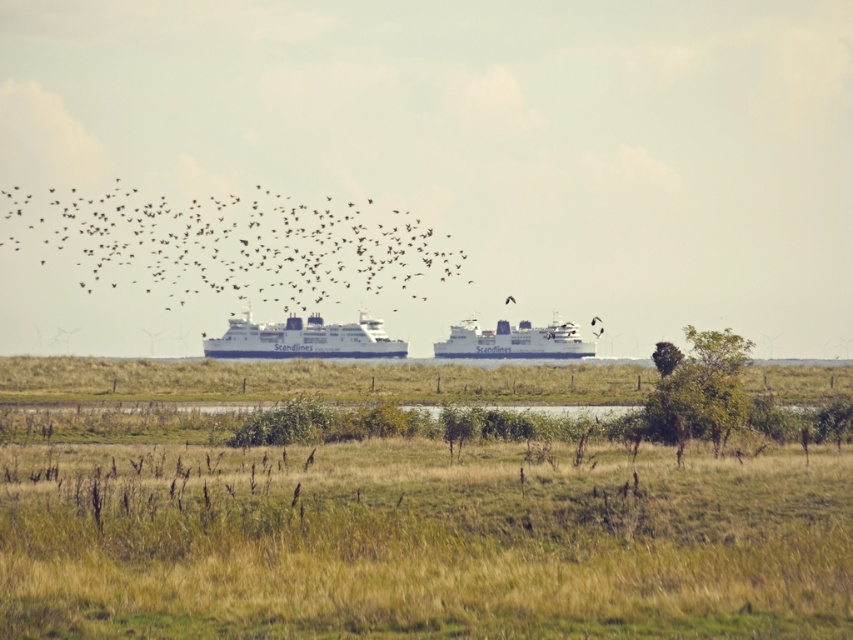
Question: Is the position of black matte birds at upper center more distant than that of black matte bird at center?

Choices:
 (A) no
 (B) yes

Answer: (B)

Question: Can you confirm if black matte birds at upper center is smaller than white matte ferry at center?

Choices:
 (A) no
 (B) yes

Answer: (A)

Question: Considering the relative positions of black matte birds at upper center and black matte bird at center in the image provided, where is black matte birds at upper center located with respect to black matte bird at center?

Choices:
 (A) left
 (B) right

Answer: (A)

Question: Among these points, which one is farthest from the camera?

Choices:
 (A) (527, 346)
 (B) (509, 300)
 (C) (595, 320)
 (D) (48, 227)

Answer: (D)

Question: Which point appears farthest from the camera in this image?

Choices:
 (A) (506, 301)
 (B) (254, 189)

Answer: (B)

Question: Estimate the real-world distances between objects in this image. Which object is farther from the black matte bird at center?

Choices:
 (A) black matte birds at upper center
 (B) white matte ferry at center

Answer: (A)